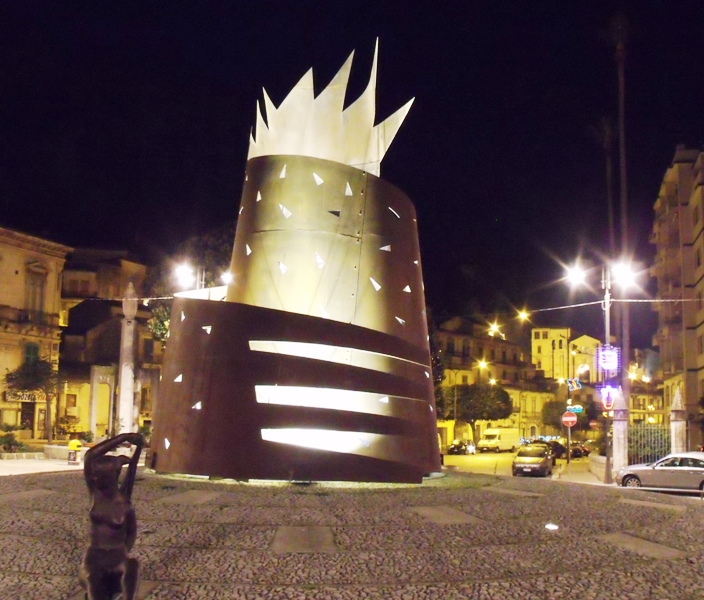
Identify the location of bronze statue. (108, 529).